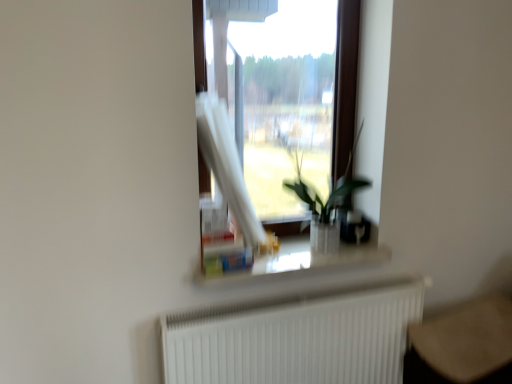
I want to click on empty space that is ontop of white matte radiator at lower center (from a real-world perspective), so click(321, 292).